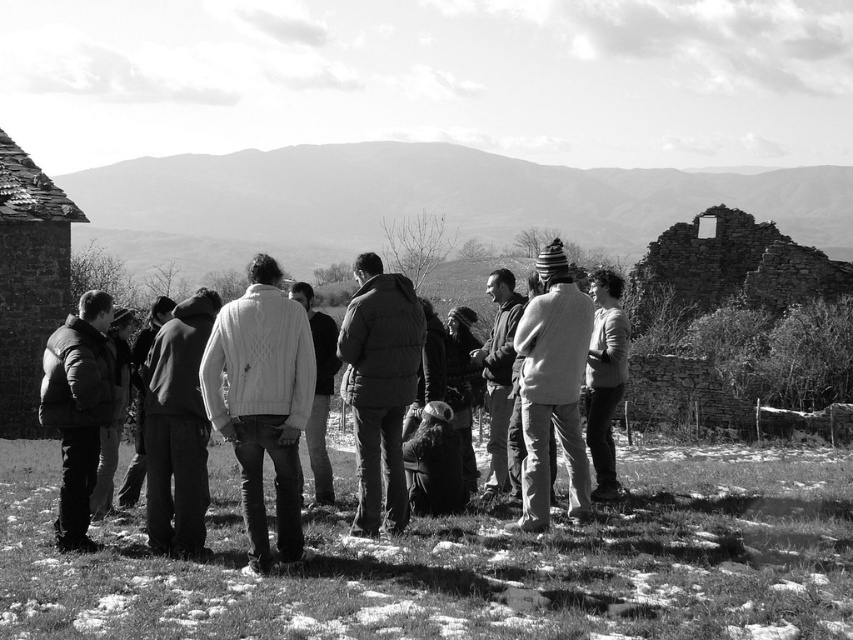
Question: Which is farther from the white knit sweater at center?

Choices:
 (A) rustic stone hut at left
 (B) white knitted sweater at center

Answer: (A)

Question: Which point is farther from the camera taking this photo?

Choices:
 (A) (532, 499)
 (B) (24, 294)
 (C) (625, 374)

Answer: (B)

Question: Is rustic stone hut at left smaller than puffy black jacket at center?

Choices:
 (A) no
 (B) yes

Answer: (A)

Question: Does white knit sweater at center have a larger size compared to puffy black jacket at center?

Choices:
 (A) yes
 (B) no

Answer: (A)

Question: Which object is farther from the camera taking this photo?

Choices:
 (A) matte black jacket at left
 (B) white knitwear at center

Answer: (B)

Question: Can you confirm if white knit sweater at center is bigger than dark brown leather jacket at right?

Choices:
 (A) no
 (B) yes

Answer: (B)